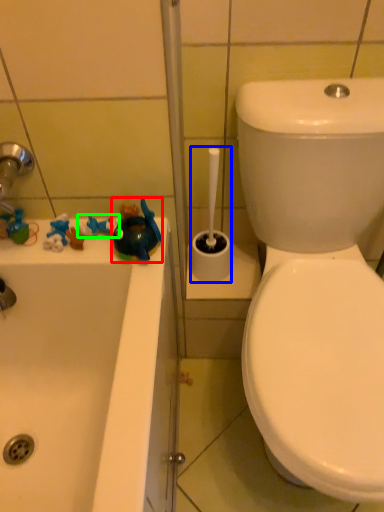
Question: Which is farther away from toy (highlighted by a red box)? shower (highlighted by a blue box) or toy (highlighted by a green box)?

Choices:
 (A) shower
 (B) toy

Answer: (A)